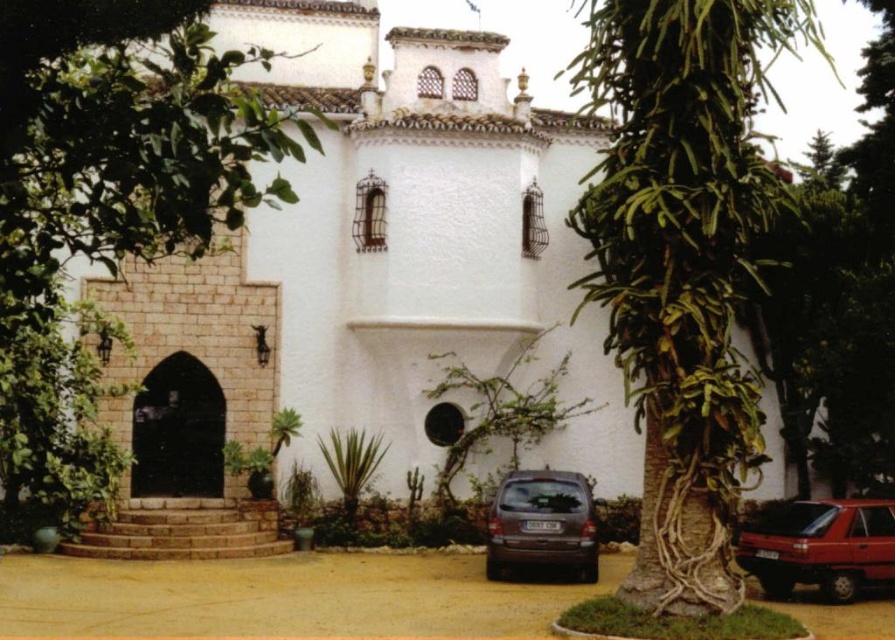
Who is positioned more to the right, green leafy tree at center or green leafy tree at left?

green leafy tree at center

Identify the location of green leafy tree at center. The width and height of the screenshot is (895, 640). (683, 262).

Where is `green leafy tree at center`? green leafy tree at center is located at coordinates (683, 262).

Does green leafy tree at left appear on the right side of satin brown minivan at lower center?

Incorrect, green leafy tree at left is not on the right side of satin brown minivan at lower center.

Consider the image. Is green leafy tree at left to the left of satin brown minivan at lower center from the viewer's perspective?

Correct, you'll find green leafy tree at left to the left of satin brown minivan at lower center.

Is point (45, 76) closer to camera compared to point (594, 532)?

Yes, point (45, 76) is closer to viewer.

The height and width of the screenshot is (640, 895). Identify the location of green leafy tree at left. (107, 208).

Does green leafy tree at center appear on the left side of shiny red car at lower right?

Indeed, green leafy tree at center is positioned on the left side of shiny red car at lower right.

Consider the image. Can you confirm if green leafy tree at center is wider than shiny red car at lower right?

Correct, the width of green leafy tree at center exceeds that of shiny red car at lower right.

Who is more forward, (584, 196) or (771, 550)?

Positioned in front is point (771, 550).

Where is `green leafy tree at center`? The width and height of the screenshot is (895, 640). green leafy tree at center is located at coordinates (683, 262).